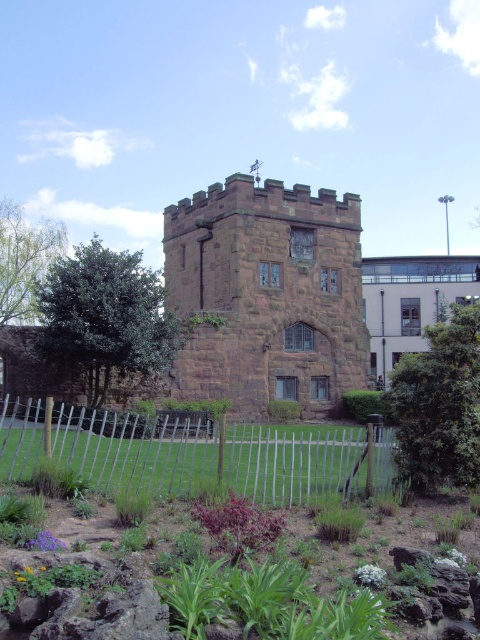
You are an architect planning to build a new garden path around the brown stone tower at center and the white wooden fence at lower center. Based on their sizes, which structure requires a wider path to accommodate its width?

The brown stone tower at center requires a wider path because its width is larger than the white wooden fence at lower center.

From the picture: You are a maintenance worker who needs to trim the green leafy plants at lower center. The white wooden fence at lower center is in the way. Can you reach the plants without touching the fence?

The white wooden fence at lower center is 11.37 inches from green leafy plants at lower center. Since the distance is over 10 inches, you can reach the plants without touching the fence.

You are a visitor standing in front of the brown stone tower at center and the white wooden fence at lower center. Which object would appear larger to you?

The brown stone tower at center is bigger than the white wooden fence at lower center, so it would appear larger to you.